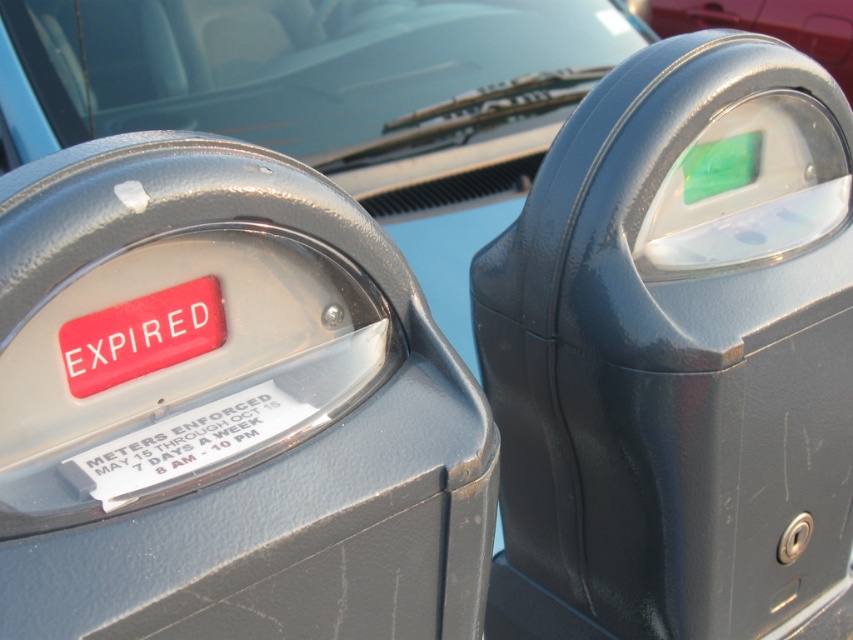
Question: Based on their relative distances, which object is farther from the matte gray parking meter at left?

Choices:
 (A) transparent glass windshield at upper center
 (B) white paper sticker at center
 (C) glossy plastic parking meter at center

Answer: (A)

Question: Can you confirm if glossy plastic parking meter at center is positioned to the right of metallic red car at upper right?

Choices:
 (A) yes
 (B) no

Answer: (B)

Question: Which point is farther to the camera?

Choices:
 (A) (x=280, y=397)
 (B) (x=592, y=340)

Answer: (B)

Question: Is matte gray parking meter at left to the right of white paper sticker at center from the viewer's perspective?

Choices:
 (A) yes
 (B) no

Answer: (A)

Question: Which object appears closest to the camera in this image?

Choices:
 (A) white paper sticker at center
 (B) transparent glass windshield at upper center
 (C) metallic red car at upper right
 (D) matte gray parking meter at left

Answer: (D)

Question: Does glossy plastic parking meter at center have a larger size compared to white paper sticker at center?

Choices:
 (A) yes
 (B) no

Answer: (A)